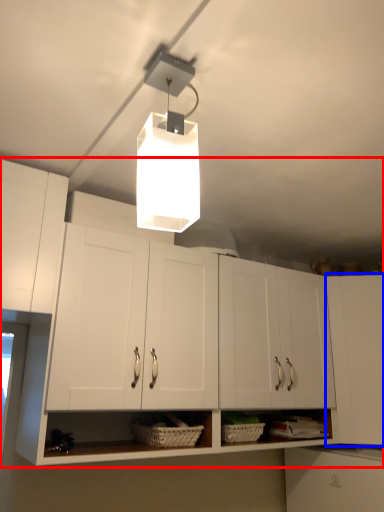
Question: Which object appears farthest to the camera in this image, cabinetry (highlighted by a red box) or cabinetry (highlighted by a blue box)?

Choices:
 (A) cabinetry
 (B) cabinetry

Answer: (B)